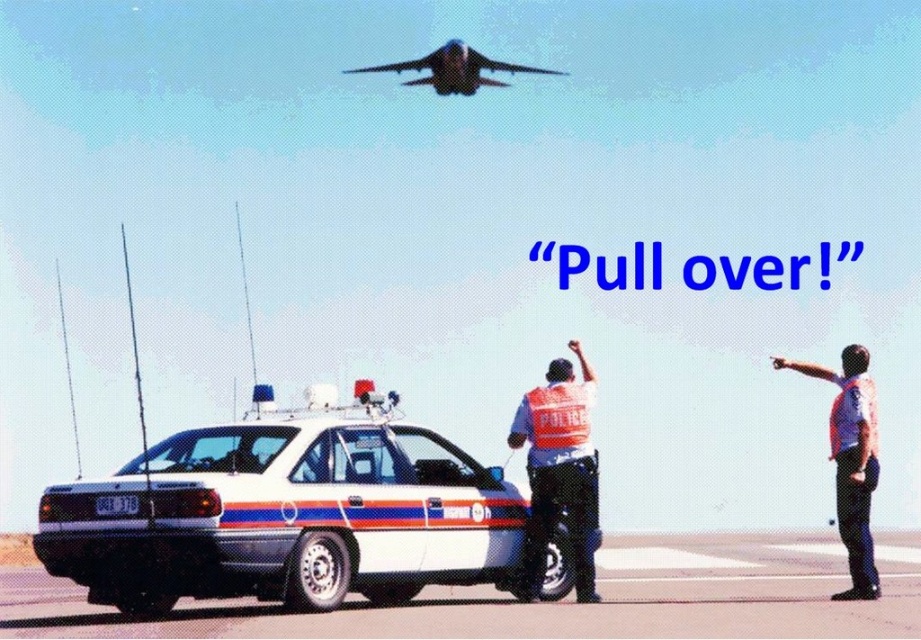
Question: Is white glossy police car at center further to camera compared to reflective orange vest at center?

Choices:
 (A) no
 (B) yes

Answer: (A)

Question: Which of the following is the closest to the observer?

Choices:
 (A) reflective orange vest at center
 (B) white glossy police car at center

Answer: (B)

Question: Which point is farther to the camera?

Choices:
 (A) (581, 355)
 (B) (33, 547)
 (C) (429, 84)

Answer: (C)

Question: Does white glossy police car at center appear on the right side of reflective orange vest at center?

Choices:
 (A) no
 (B) yes

Answer: (A)

Question: Which point is closer to the camera taking this photo?

Choices:
 (A) (845, 468)
 (B) (555, 502)
 (C) (382, 472)
 (D) (424, 83)

Answer: (C)

Question: From the image, what is the correct spatial relationship of white glossy police car at center in relation to light blue uniform at center?

Choices:
 (A) right
 (B) left

Answer: (B)